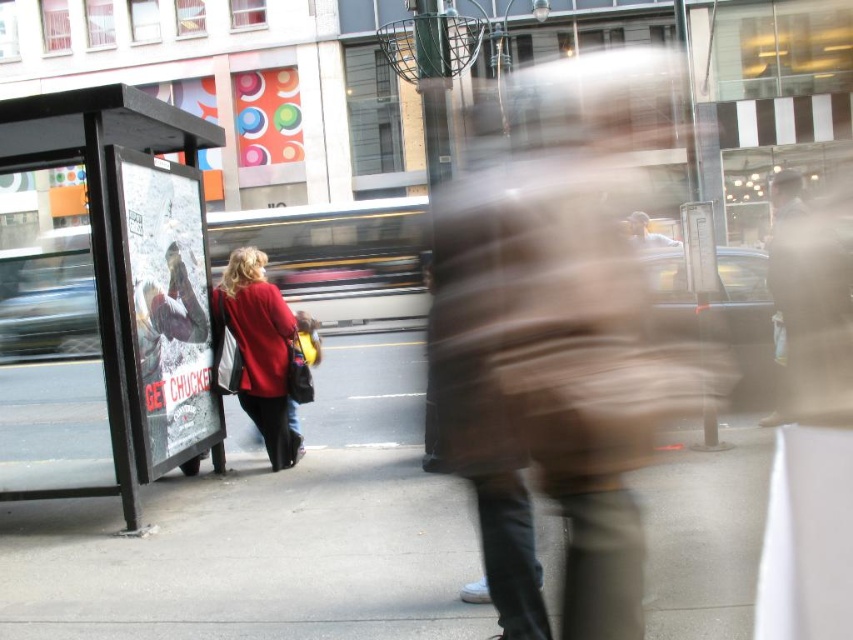
You are a photographer standing at the bus stop shelter with the poster. You want to take a photo of both the blurred figure in the foreground and the vehicles in the background. Which of the two points, point (x=189, y=141) or point (x=256, y=396), should you focus on to ensure both the foreground figure and background vehicles are in focus?

You should focus on point (x=256, y=396) because it is farther from the camera than point (x=189, y=141). This allows the depth of field to cover both the closer foreground figure and the distant background vehicles.

You are a pedestrian trying to cross the street and see the brown leather jacket at right and the matte red coat at center. Which clothing item is closer to the bus stop shelter?

The brown leather jacket at right is positioned over the matte red coat at center, meaning it is closer to the bus stop shelter.